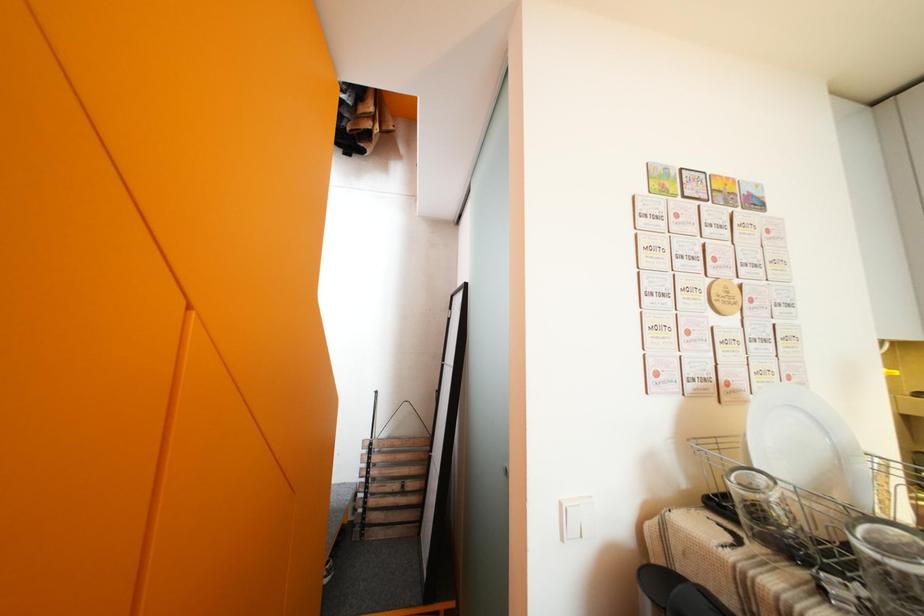
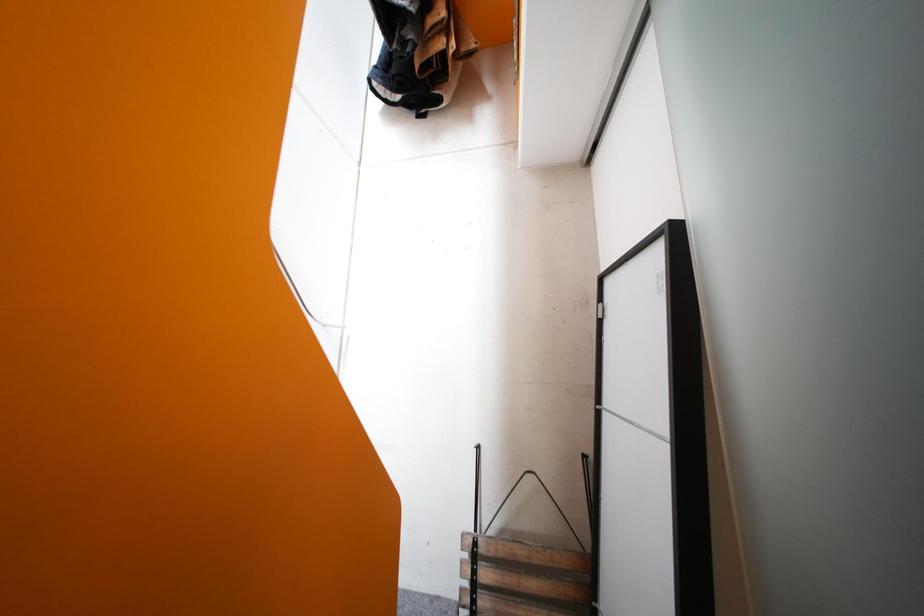
Question: Based on the continuous images, in which direction is the camera rotating? Reply with the corresponding letter.

Choices:
 (A) Left
 (B) Right
 (C) Up
 (D) Down

Answer: (A)